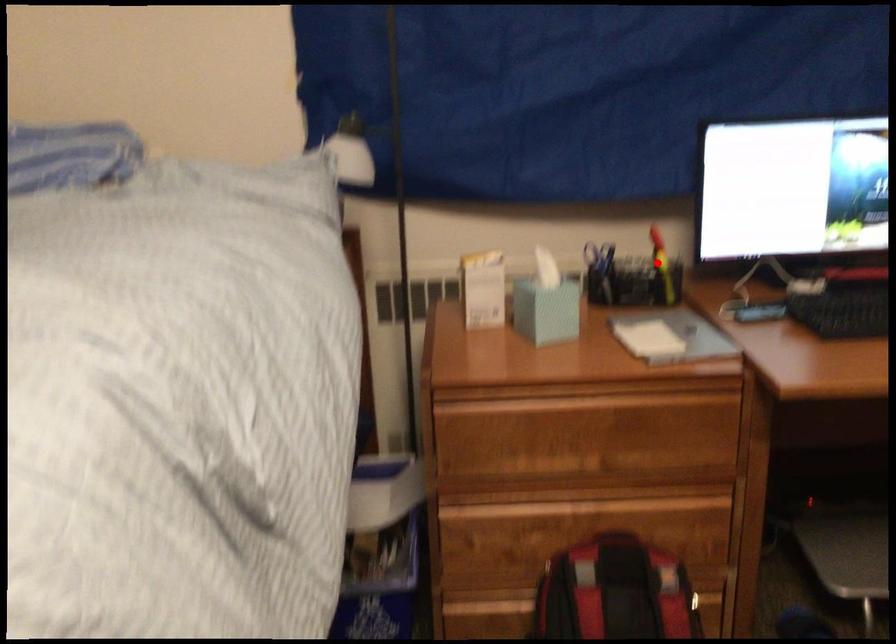
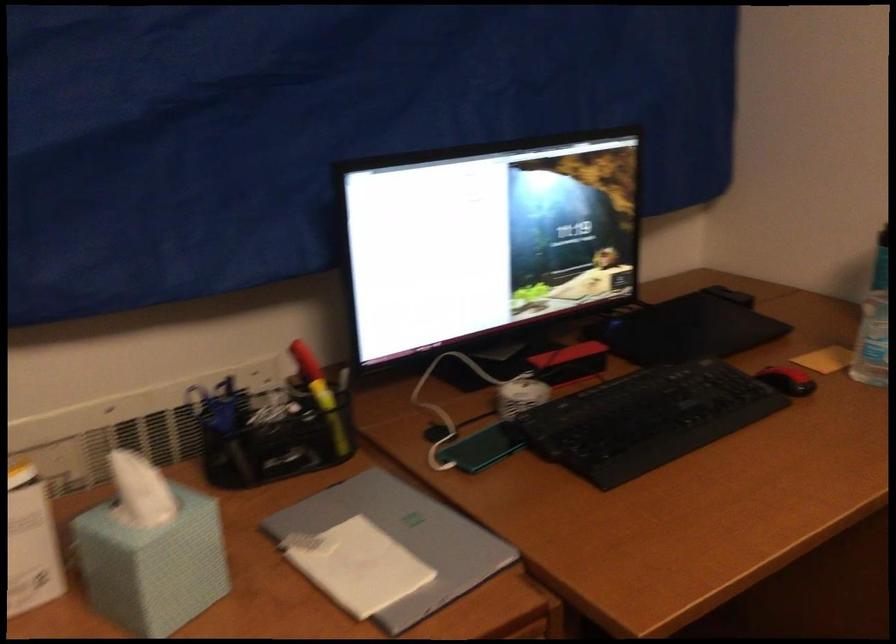
In the second image, find the point that corresponds to the highlighted location in the first image.

(321, 395)